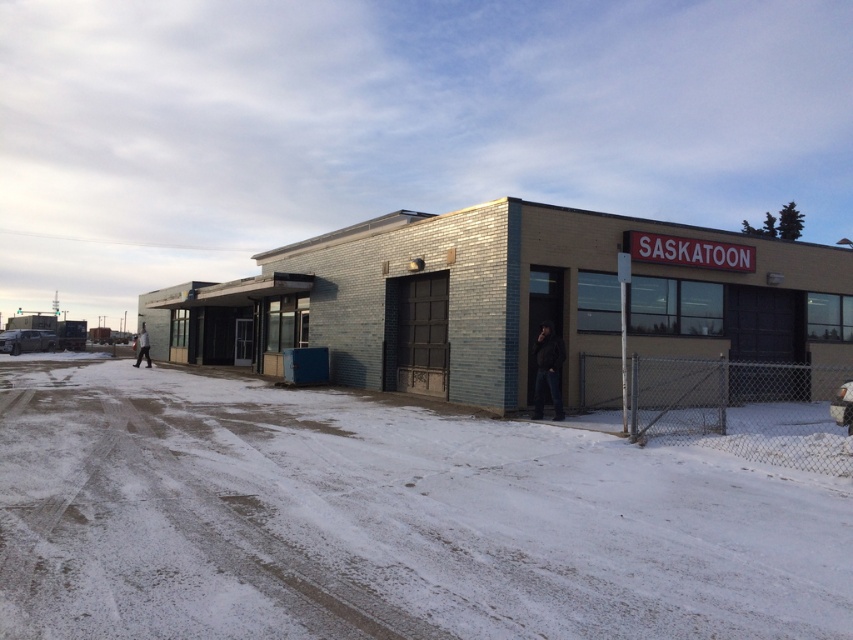
Question: Does white powdery snow at lower center come in front of dark brown leather jacket at lower right?

Choices:
 (A) yes
 (B) no

Answer: (A)

Question: Which of the following is the farthest from the observer?

Choices:
 (A) (724, 288)
 (B) (178, 573)

Answer: (A)

Question: Which of the following is the farthest from the observer?

Choices:
 (A) (428, 612)
 (B) (538, 412)

Answer: (B)

Question: Is white powdery snow at lower center to the left of dark brown leather jacket at lower right from the viewer's perspective?

Choices:
 (A) no
 (B) yes

Answer: (B)

Question: Where is white powdery snow at lower center located in relation to brick building at center in the image?

Choices:
 (A) above
 (B) below

Answer: (B)

Question: Considering the real-world distances, which object is closest to the brick building at center?

Choices:
 (A) dark brown leather jacket at lower right
 (B) white powdery snow at lower center

Answer: (A)